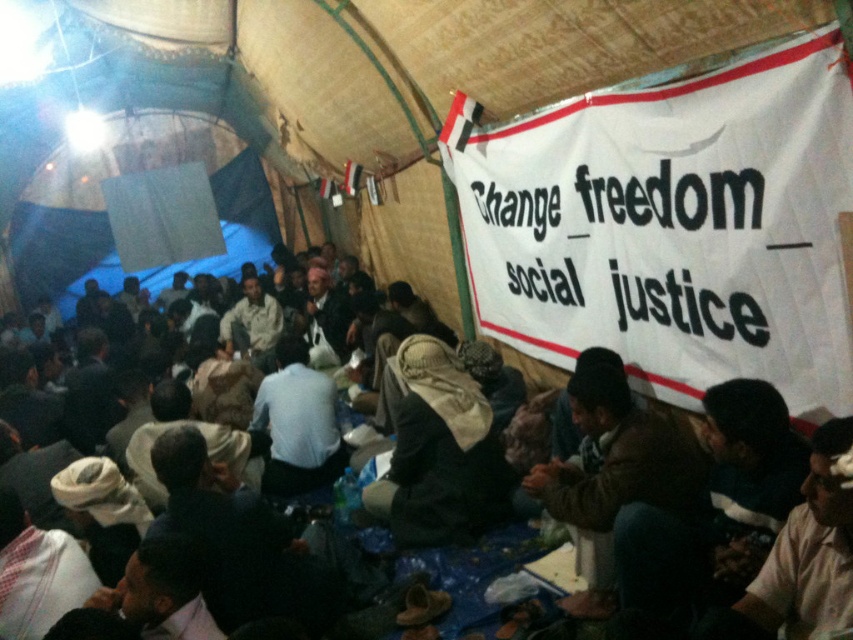
Who is taller, white textured shirt at lower right or dark brown leather jacket at center?

white textured shirt at lower right

Does white textured shirt at lower right appear on the right side of dark brown leather jacket at center?

Correct, you'll find white textured shirt at lower right to the right of dark brown leather jacket at center.

Image resolution: width=853 pixels, height=640 pixels. Describe the element at coordinates (809, 552) in the screenshot. I see `white textured shirt at lower right` at that location.

I want to click on white textured shirt at lower right, so click(x=809, y=552).